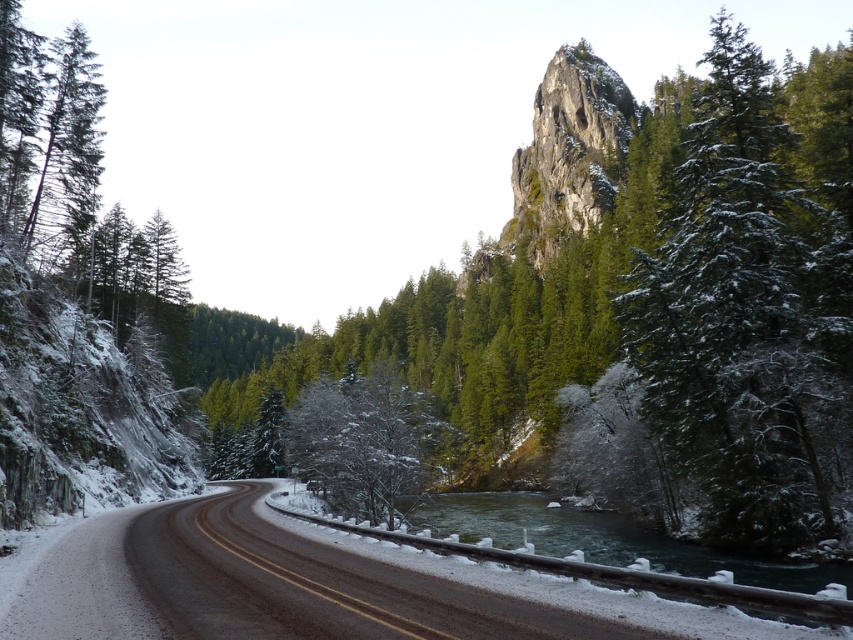
I want to click on green matte tree at upper right, so click(x=751, y=308).

Between green matte tree at upper right and greenish-blue water at center, which one appears on the right side from the viewer's perspective?

From the viewer's perspective, green matte tree at upper right appears more on the right side.

Does point (682, 432) come in front of point (633, 532)?

Yes, point (682, 432) is in front of point (633, 532).

The height and width of the screenshot is (640, 853). Find the location of `green matte tree at upper right`. green matte tree at upper right is located at coordinates (751, 308).

From the picture: Who is positioned more to the left, black asphalt highway at center or greenish-blue water at center?

black asphalt highway at center is more to the left.

Which is behind, point (265, 600) or point (844, 577)?

The point (844, 577) is more distant.

You are a GUI agent. You are given a task and a screenshot of the screen. Output one action in this format:
    pyautogui.click(x=<x>, y=<y>)
    Task: Click on the black asphalt highway at center
    The height and width of the screenshot is (640, 853).
    Given the screenshot: What is the action you would take?
    pyautogui.click(x=264, y=586)

Which is more to the left, green matte tree at upper right or black asphalt highway at center?

black asphalt highway at center is more to the left.

Does point (672, 396) come closer to viewer compared to point (254, 524)?

That is False.

The height and width of the screenshot is (640, 853). I want to click on green matte tree at upper right, so click(751, 308).